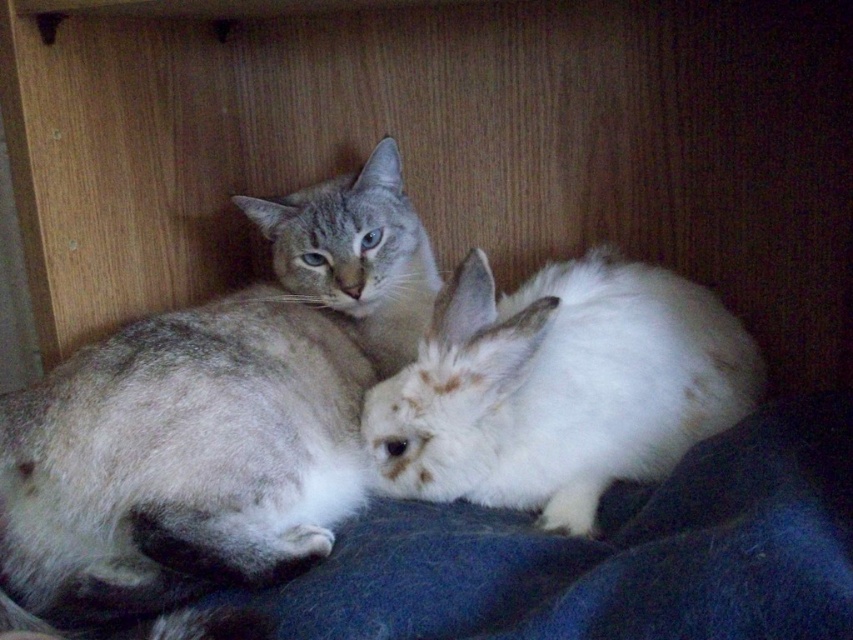
You are an animal caretaker looking at the image of a wooden cabinet. You need to place a new feeding bowl for the gray fur cat at upper left. Where should you position the bowl relative to the cat?

The gray fur cat at upper left is located at coordinates 0.652 on the x axis and 0.254 on the y axis, so the feeding bowl should be placed near those coordinates to ensure the cat can easily access it.

You are a pet owner who wants to place a new toy between the gray fur cat at upper left and the white fluffy rabbit at center. According to their positions, where should you place the toy so that it is between them?

The gray fur cat at upper left is below the white fluffy rabbit at center, so you should place the toy above the cat and below the rabbit to position it between them.